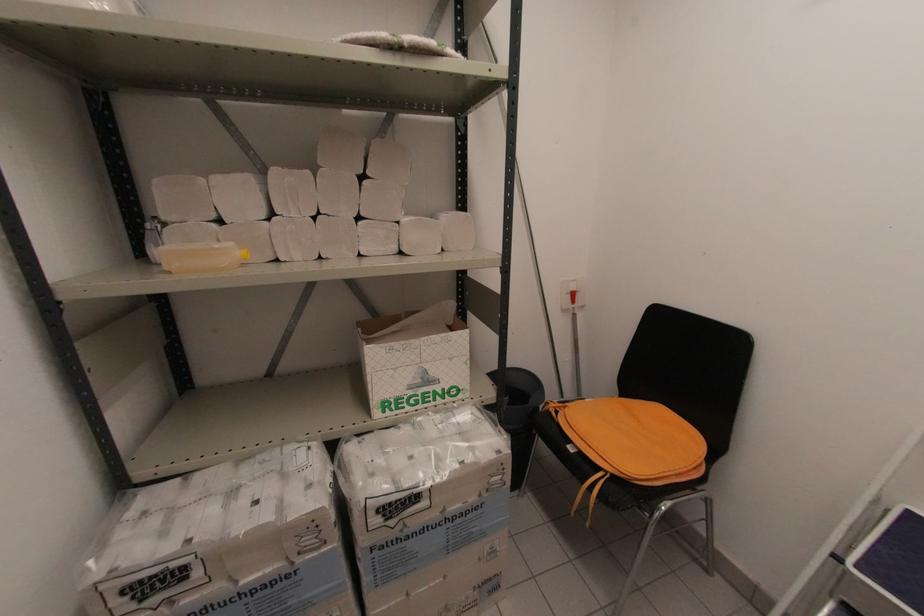
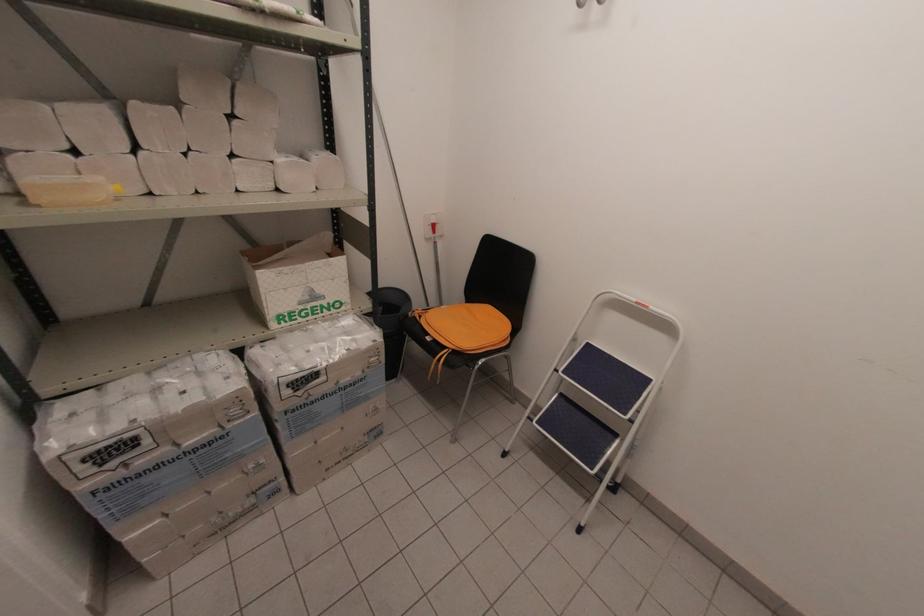
In the second image, find the point that corresponds to (512,453) in the first image.

(383, 341)